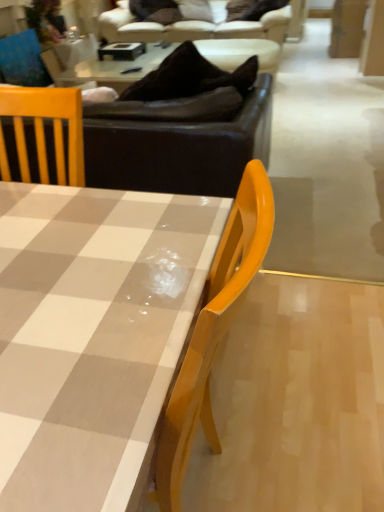
The image size is (384, 512). What do you see at coordinates (191, 28) in the screenshot?
I see `brown leather couch at upper center, the second studio couch viewed from the front` at bounding box center [191, 28].

This screenshot has width=384, height=512. Find the location of `brown leather couch at upper center, the second studio couch viewed from the front`. brown leather couch at upper center, the second studio couch viewed from the front is located at coordinates (191, 28).

This screenshot has width=384, height=512. Find the location of `matte blue cushion at upper left`. matte blue cushion at upper left is located at coordinates (23, 60).

Measure the distance between point (17, 65) and camera.

A distance of 4.44 meters exists between point (17, 65) and camera.

Where is `brown leather couch at upper center, marked as the second studio couch in a top-to-bottom arrangement`? brown leather couch at upper center, marked as the second studio couch in a top-to-bottom arrangement is located at coordinates (179, 149).

Is matte brown plywood at upper right positioned in front of brown leather couch at upper center, the 1th studio couch from the front?

That is False.

Looking at this image, is matte brown plywood at upper right next to brown leather couch at upper center, the first studio couch from the bottom?

matte brown plywood at upper right and brown leather couch at upper center, the first studio couch from the bottom, are clearly separated.

Is matte brown plywood at upper right turned away from brown leather couch at upper center, marked as the second studio couch in a top-to-bottom arrangement?

No, matte brown plywood at upper right is not facing away from brown leather couch at upper center, marked as the second studio couch in a top-to-bottom arrangement.

Does brown leather couch at upper center, which is the 1th studio couch in top-to-bottom order, have a larger size compared to brown leather couch at upper center, marked as the second studio couch in a top-to-bottom arrangement?

Indeed, brown leather couch at upper center, which is the 1th studio couch in top-to-bottom order, has a larger size compared to brown leather couch at upper center, marked as the second studio couch in a top-to-bottom arrangement.

Does point (137, 28) come farther from viewer compared to point (223, 155)?

That is True.

Is brown leather couch at upper center, which ranks as the 1th studio couch in back-to-front order, further to the viewer compared to brown leather couch at upper center, the 1th studio couch from the front?

Yes, the depth of brown leather couch at upper center, which ranks as the 1th studio couch in back-to-front order, is greater than that of brown leather couch at upper center, the 1th studio couch from the front.

How many degrees apart are the facing directions of brown leather couch at upper center, the second studio couch viewed from the front, and brown leather couch at upper center, the first studio couch from the bottom?

The angular difference between brown leather couch at upper center, the second studio couch viewed from the front, and brown leather couch at upper center, the first studio couch from the bottom, is 179 degrees.

Locate an element on the screen. Image resolution: width=384 pixels, height=512 pixels. plywood that appears behind the brown leather couch at upper center, marked as the second studio couch in a top-to-bottom arrangement is located at coordinates (347, 28).

Between brown leather couch at upper center, the first studio couch from the bottom, and matte brown plywood at upper right, which one appears on the right side from the viewer's perspective?

Positioned to the right is matte brown plywood at upper right.

Between brown leather couch at upper center, the 1th studio couch from the front, and matte brown plywood at upper right, which one is positioned in front?

Positioned in front is brown leather couch at upper center, the 1th studio couch from the front.

From a real-world perspective, is brown leather couch at upper center, marked as the second studio couch in a top-to-bottom arrangement, above or below matte brown plywood at upper right?

brown leather couch at upper center, marked as the second studio couch in a top-to-bottom arrangement, is situated higher than matte brown plywood at upper right in the real world.

Is matte blue cushion at upper left located outside brown leather couch at upper center, the 1th studio couch from the front?

Yes.

Who is more distant, matte blue cushion at upper left or brown leather couch at upper center, the 1th studio couch from the front?

Positioned behind is matte blue cushion at upper left.

From their relative heights in the image, would you say matte blue cushion at upper left is taller or shorter than brown leather couch at upper center, the first studio couch from the bottom?

matte blue cushion at upper left is shorter than brown leather couch at upper center, the first studio couch from the bottom.

From the image's perspective, between matte blue cushion at upper left and brown leather couch at upper center, arranged as the 2th studio couch when viewed from the back, which one is located above?

matte blue cushion at upper left appears higher in the image.

How far apart are matte blue cushion at upper left and checkered fabric coffee table at center?

The distance of matte blue cushion at upper left from checkered fabric coffee table at center is 4.09 meters.

Can you confirm if matte blue cushion at upper left is shorter than checkered fabric coffee table at center?

Yes, matte blue cushion at upper left is shorter than checkered fabric coffee table at center.

Can you confirm if matte blue cushion at upper left is smaller than checkered fabric coffee table at center?

Correct, matte blue cushion at upper left occupies less space than checkered fabric coffee table at center.

Is matte blue cushion at upper left facing towards checkered fabric coffee table at center?

No, matte blue cushion at upper left is not facing towards checkered fabric coffee table at center.

Is checkered fabric coffee table at center at the back of matte brown plywood at upper right?

No, matte brown plywood at upper right is not facing the opposite direction of checkered fabric coffee table at center.

Can you tell me how much matte brown plywood at upper right and checkered fabric coffee table at center differ in facing direction?

matte brown plywood at upper right and checkered fabric coffee table at center are facing 91.3 degrees away from each other.

From the image's perspective, would you say matte brown plywood at upper right is shown under checkered fabric coffee table at center?

Actually, matte brown plywood at upper right appears above checkered fabric coffee table at center in the image.

Can you confirm if matte brown plywood at upper right is wider than checkered fabric coffee table at center?

Incorrect, the width of matte brown plywood at upper right does not surpass that of checkered fabric coffee table at center.

Which is farther, (54,471) or (32,30)?

Positioned behind is point (32,30).

Is matte blue cushion at upper left at the back of checkered fabric coffee table at center?

That's not correct — checkered fabric coffee table at center is not looking away from matte blue cushion at upper left.

Looking at this image, which of these two, checkered fabric coffee table at center or matte blue cushion at upper left, is thinner?

With smaller width is matte blue cushion at upper left.

Identify the location of coffee table in front of the matte blue cushion at upper left. The width and height of the screenshot is (384, 512). (92, 334).

Find the location of a particular element. Image resolution: width=384 pixels, height=512 pixels. the 2nd studio couch in front of the matte brown plywood at upper right is located at coordinates (179, 149).

Where is `studio couch that is behind the brown leather couch at upper center, the first studio couch from the bottom`? studio couch that is behind the brown leather couch at upper center, the first studio couch from the bottom is located at coordinates (191, 28).

Which object lies further to the anchor point brown leather couch at upper center, marked as the second studio couch in a top-to-bottom arrangement, matte brown plywood at upper right or matte blue cushion at upper left?

Based on the image, matte brown plywood at upper right appears to be further to brown leather couch at upper center, marked as the second studio couch in a top-to-bottom arrangement.

Considering their positions, is matte brown plywood at upper right positioned further to matte blue cushion at upper left than brown leather couch at upper center, arranged as the second studio couch when ordered from the bottom?

matte brown plywood at upper right is further to matte blue cushion at upper left.

Estimate the real-world distances between objects in this image. Which object is further from checkered fabric coffee table at center, brown leather couch at upper center, marked as the second studio couch in a top-to-bottom arrangement, or matte blue cushion at upper left?

The object further to checkered fabric coffee table at center is matte blue cushion at upper left.

Which object lies nearer to the anchor point brown leather couch at upper center, which ranks as the 1th studio couch in back-to-front order, matte blue cushion at upper left or matte brown plywood at upper right?

Among the two, matte blue cushion at upper left is located nearer to brown leather couch at upper center, which ranks as the 1th studio couch in back-to-front order.

Estimate the real-world distances between objects in this image. Which object is further from brown leather couch at upper center, the 1th studio couch from the front, checkered fabric coffee table at center or matte blue cushion at upper left?

Based on the image, matte blue cushion at upper left appears to be further to brown leather couch at upper center, the 1th studio couch from the front.

Estimate the real-world distances between objects in this image. Which object is further from matte brown plywood at upper right, brown leather couch at upper center, which ranks as the 1th studio couch in back-to-front order, or checkered fabric coffee table at center?

checkered fabric coffee table at center is positioned further to the anchor matte brown plywood at upper right.

Considering their positions, is brown leather couch at upper center, arranged as the 2th studio couch when viewed from the back, positioned further to brown leather couch at upper center, which is the 1th studio couch in top-to-bottom order, than matte blue cushion at upper left?

brown leather couch at upper center, arranged as the 2th studio couch when viewed from the back, is positioned further to the anchor brown leather couch at upper center, which is the 1th studio couch in top-to-bottom order.

Looking at the image, which one is located further to checkered fabric coffee table at center, brown leather couch at upper center, the 1th studio couch from the front, or brown leather couch at upper center, the second studio couch viewed from the front?

brown leather couch at upper center, the second studio couch viewed from the front.

The image size is (384, 512). In order to click on studio couch between checkered fabric coffee table at center and matte blue cushion at upper left from front to back in this screenshot , I will do 179,149.

Where is `swivel chair positioned between brown leather couch at upper center, arranged as the 2th studio couch when viewed from the back, and brown leather couch at upper center, which is the 1th studio couch in top-to-bottom order, from near to far`? The width and height of the screenshot is (384, 512). swivel chair positioned between brown leather couch at upper center, arranged as the 2th studio couch when viewed from the back, and brown leather couch at upper center, which is the 1th studio couch in top-to-bottom order, from near to far is located at coordinates (23, 60).

Image resolution: width=384 pixels, height=512 pixels. I want to click on studio couch between checkered fabric coffee table at center and brown leather couch at upper center, which is the 1th studio couch in top-to-bottom order, along the z-axis, so [179, 149].

Identify the location of studio couch between brown leather couch at upper center, the first studio couch from the bottom, and matte brown plywood at upper right in the front-back direction. (191, 28).